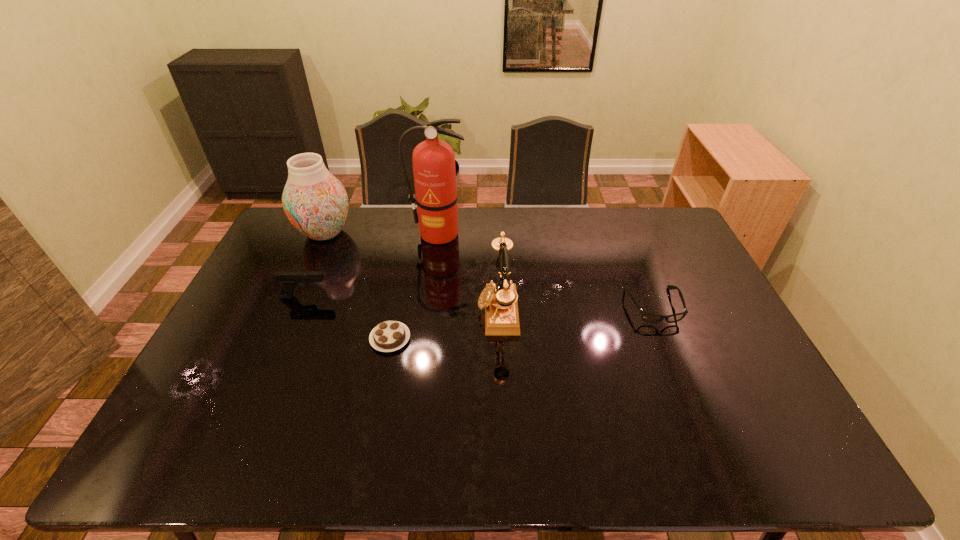
Find the location of a particular element. This screenshot has width=960, height=540. fire extinguisher is located at coordinates (434, 170).

This screenshot has width=960, height=540. In order to click on the second tallest object in this screenshot , I will do `click(316, 203)`.

You are a GUI agent. You are given a task and a screenshot of the screen. Output one action in this format:
    pyautogui.click(x=<x>, y=<y>)
    Task: Click on the telephone
    The image size is (960, 540).
    Given the screenshot: What is the action you would take?
    pyautogui.click(x=499, y=299)

Where is `the third tallest object`? The height and width of the screenshot is (540, 960). the third tallest object is located at coordinates (499, 299).

Locate an element on the screen. The height and width of the screenshot is (540, 960). the third shortest object is located at coordinates (289, 280).

This screenshot has height=540, width=960. I want to click on spectacles, so click(x=648, y=317).

This screenshot has width=960, height=540. I want to click on the second shortest object, so click(x=648, y=317).

You are a GUI agent. You are given a task and a screenshot of the screen. Output one action in this format:
    pyautogui.click(x=<x>, y=<y>)
    Task: Click on the chocolate cake
    The height and width of the screenshot is (540, 960).
    Given the screenshot: What is the action you would take?
    pyautogui.click(x=388, y=336)

Find the location of a particular element. vacant region located 0.140m on the side of the tallest object with the nozzle and handle is located at coordinates (434, 272).

Find the location of `vacant space situated on the right of the fifth shortest object`. vacant space situated on the right of the fifth shortest object is located at coordinates (444, 233).